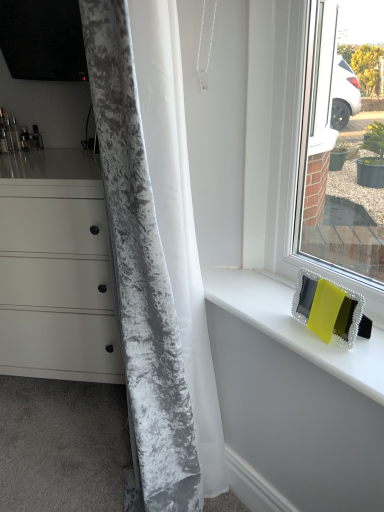
Question: Can you confirm if velvet gray curtain at left is taller than yellow fabric at upper right?

Choices:
 (A) yes
 (B) no

Answer: (A)

Question: From a real-world perspective, is velvet gray curtain at left located higher than yellow fabric at upper right?

Choices:
 (A) yes
 (B) no

Answer: (A)

Question: Is velvet gray curtain at left outside yellow fabric at upper right?

Choices:
 (A) yes
 (B) no

Answer: (A)

Question: Considering the relative sizes of velvet gray curtain at left and yellow fabric at upper right in the image provided, is velvet gray curtain at left bigger than yellow fabric at upper right?

Choices:
 (A) yes
 (B) no

Answer: (A)

Question: Is velvet gray curtain at left beside yellow fabric at upper right?

Choices:
 (A) yes
 (B) no

Answer: (B)

Question: Relative to yellow fabric at upper right, is matte yellow frame at right in front or behind?

Choices:
 (A) front
 (B) behind

Answer: (A)

Question: In terms of size, does matte yellow frame at right appear bigger or smaller than yellow fabric at upper right?

Choices:
 (A) big
 (B) small

Answer: (A)

Question: Considering the positions of point [324, 32] and point [243, 300], is point [324, 32] closer or farther from the camera than point [243, 300]?

Choices:
 (A) closer
 (B) farther

Answer: (B)

Question: From the image's perspective, is matte yellow frame at right above or below yellow fabric at upper right?

Choices:
 (A) below
 (B) above

Answer: (B)

Question: Is matte yellow frame at right bigger or smaller than velvet gray curtain at left?

Choices:
 (A) big
 (B) small

Answer: (B)

Question: Relative to velvet gray curtain at left, is matte yellow frame at right in front or behind?

Choices:
 (A) front
 (B) behind

Answer: (B)

Question: Looking at their shapes, would you say matte yellow frame at right is wider or thinner than velvet gray curtain at left?

Choices:
 (A) wide
 (B) thin

Answer: (B)

Question: From the image's perspective, relative to velvet gray curtain at left, is matte yellow frame at right above or below?

Choices:
 (A) above
 (B) below

Answer: (A)

Question: In terms of size, does matte white chest of drawers at left appear bigger or smaller than yellow fabric at upper right?

Choices:
 (A) small
 (B) big

Answer: (B)

Question: Considering the relative positions of matte white chest of drawers at left and yellow fabric at upper right in the image provided, is matte white chest of drawers at left to the left or to the right of yellow fabric at upper right?

Choices:
 (A) right
 (B) left

Answer: (B)